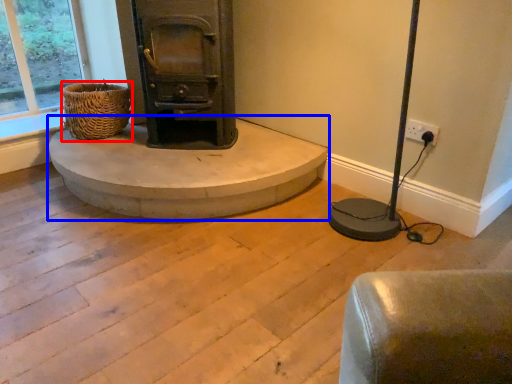
Question: Which point is closer to the camera, basket (highlighted by a red box) or concrete (highlighted by a blue box)?

Choices:
 (A) basket
 (B) concrete

Answer: (B)